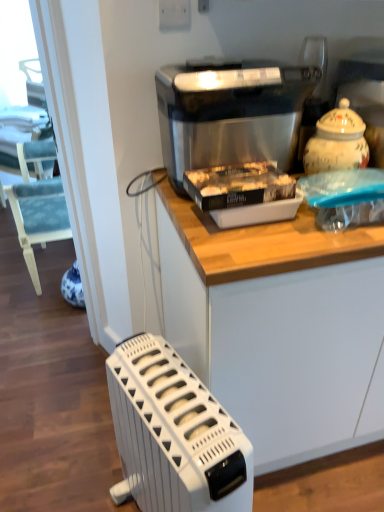
Question: Is white matte cabinet at upper center to the right of white plastic radiator at lower left from the viewer's perspective?

Choices:
 (A) no
 (B) yes

Answer: (B)

Question: From the image's perspective, is white matte cabinet at upper center located above white plastic radiator at lower left?

Choices:
 (A) yes
 (B) no

Answer: (A)

Question: Can you confirm if white matte cabinet at upper center is positioned to the left of white plastic radiator at lower left?

Choices:
 (A) yes
 (B) no

Answer: (B)

Question: From a real-world perspective, is white matte cabinet at upper center located higher than white plastic radiator at lower left?

Choices:
 (A) yes
 (B) no

Answer: (A)

Question: Is white matte cabinet at upper center facing away from white plastic radiator at lower left?

Choices:
 (A) yes
 (B) no

Answer: (B)

Question: Can white plastic radiator at lower left be found inside white matte cabinet at upper center?

Choices:
 (A) yes
 (B) no

Answer: (B)

Question: Can you confirm if stainless steel ice maker at center is thinner than white plastic radiator at lower left?

Choices:
 (A) no
 (B) yes

Answer: (B)

Question: Is stainless steel ice maker at center beside white plastic radiator at lower left?

Choices:
 (A) yes
 (B) no

Answer: (B)

Question: Does stainless steel ice maker at center have a smaller size compared to white plastic radiator at lower left?

Choices:
 (A) no
 (B) yes

Answer: (B)

Question: From the image's perspective, is stainless steel ice maker at center below white plastic radiator at lower left?

Choices:
 (A) no
 (B) yes

Answer: (A)

Question: From a real-world perspective, is stainless steel ice maker at center located beneath white plastic radiator at lower left?

Choices:
 (A) no
 (B) yes

Answer: (A)

Question: Does stainless steel ice maker at center have a larger size compared to white plastic radiator at lower left?

Choices:
 (A) yes
 (B) no

Answer: (B)

Question: Considering the relative sizes of white plastic radiator at lower left and stainless steel ice maker at center in the image provided, is white plastic radiator at lower left thinner than stainless steel ice maker at center?

Choices:
 (A) no
 (B) yes

Answer: (A)